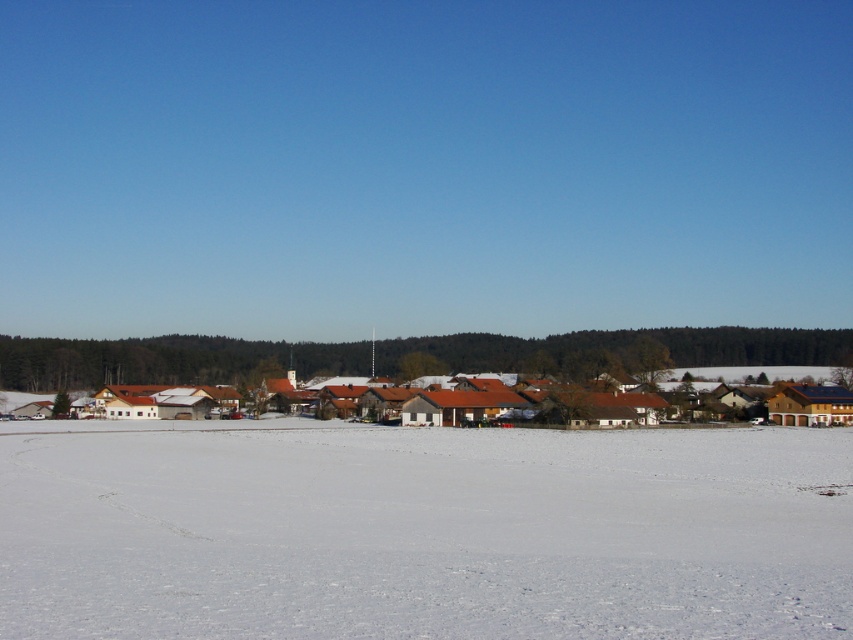
From the picture: You are an architect designing a new path through the winter village. You need to decide whether to place the path on the white powdery snow at center or the brown wooden houses at center. Which location is physically possible for the path to be placed?

The white powdery snow at center is positioned over brown wooden houses at center, meaning the snow is on top of the houses. Since the snow is covering the houses, the path cannot be placed on the snow over the houses. Therefore, the physically possible location for the path is the brown wooden houses at center, but since the snow is on top, you might need to clear the snow first.

You are an architect planning to build a new structure in the village. You notice the white powdery snow at center and the brown wooden houses at center. Which one is higher in elevation?

The white powdery snow at center is taller than brown wooden houses at center, so the snow is higher in elevation.

You are a delivery drone that needs to land in a safe area. The white powdery snow at center is flat and clear, while the brown wooden houses at center are solid structures. Given that the minimum safe distance for landing is 100 feet from any obstacle, can you safely land between them?

The white powdery snow at center and brown wooden houses at center are 307.90 feet apart. Since the minimum safe distance for landing is 100 feet from any obstacle, the drone can safely land between them as the distance exceeds the required safety margin.